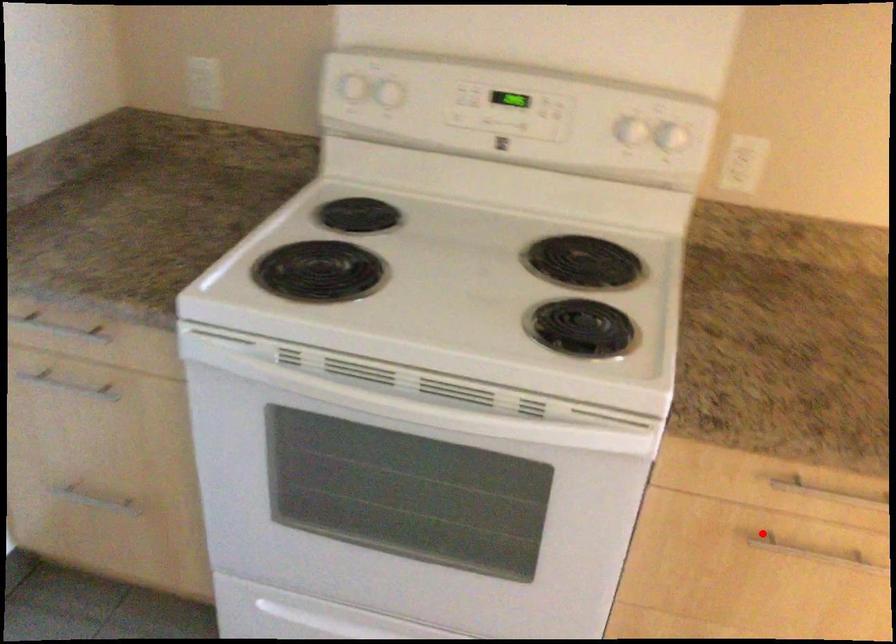
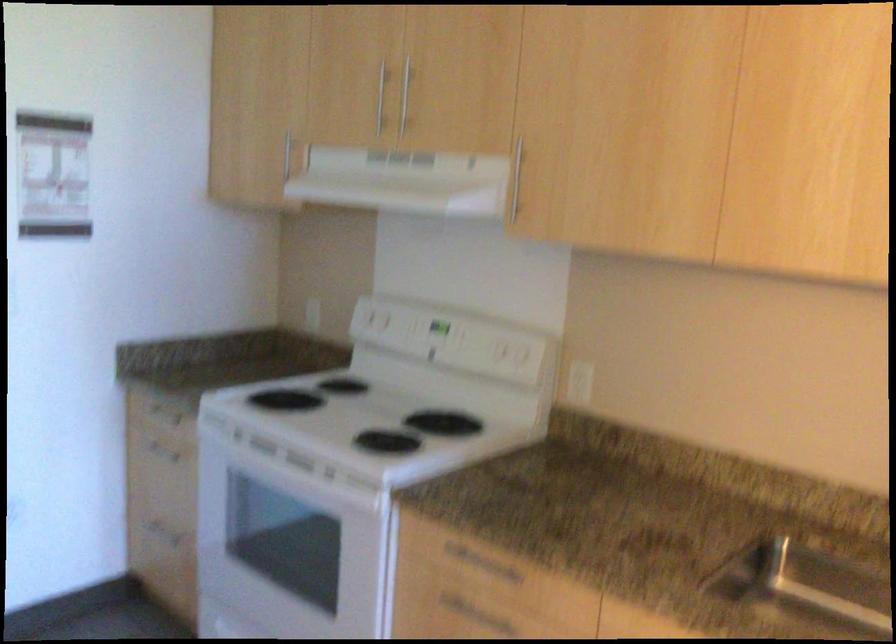
Question: I am providing you with two images of the same scene from different viewpoints. In image1, a red point is highlighted. Considering the same 3D point in image2, which of the following is correct?

Choices:
 (A) It is closer
 (B) It is farther

Answer: (B)